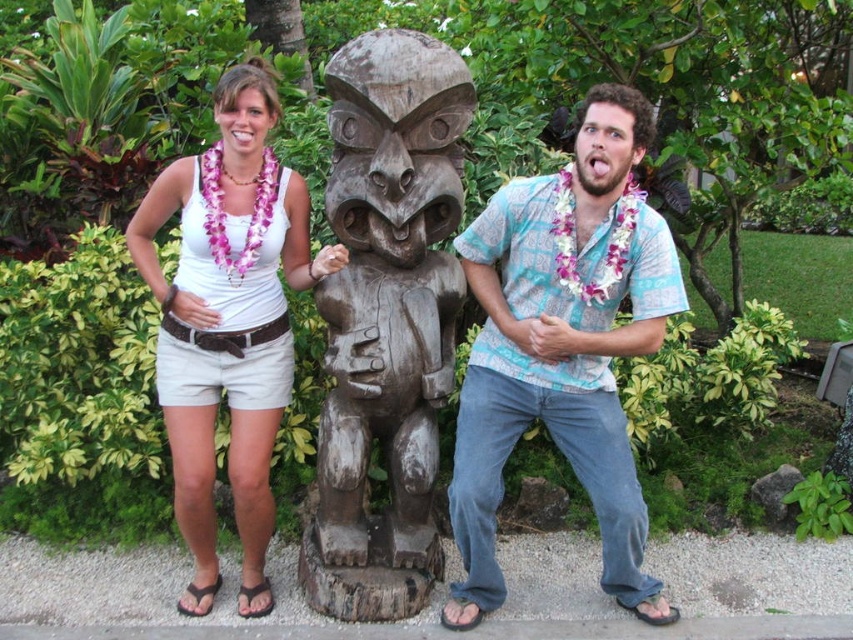
Question: Among these objects, which one is farthest from the camera?

Choices:
 (A) wooden statue at center
 (B) white fabric top at center
 (C) wooden carving at center
 (D) matte blue shirt at center

Answer: (B)

Question: Considering the real-world distances, which object is farthest from the matte blue shirt at center?

Choices:
 (A) wooden statue at center
 (B) wooden carving at center

Answer: (B)

Question: Can you confirm if wooden statue at center is bigger than matte blue shirt at center?

Choices:
 (A) no
 (B) yes

Answer: (B)

Question: Does wooden statue at center have a larger size compared to matte blue shirt at center?

Choices:
 (A) no
 (B) yes

Answer: (B)

Question: Does wooden statue at center appear under wooden carving at center?

Choices:
 (A) yes
 (B) no

Answer: (A)

Question: Among these objects, which one is farthest from the camera?

Choices:
 (A) white fabric top at center
 (B) wooden statue at center
 (C) wooden carving at center

Answer: (A)